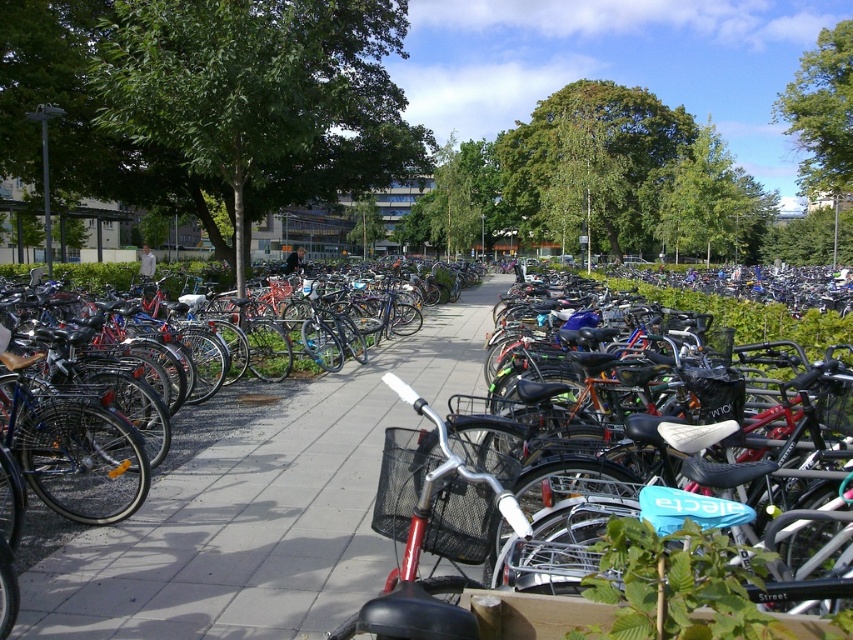
Question: Which point is closer to the camera?

Choices:
 (A) coord(473,444)
 (B) coord(131,616)

Answer: (B)

Question: Which of the following is the closest to the observer?

Choices:
 (A) matte black bicycle at center
 (B) gray concrete pavement at center

Answer: (A)

Question: In this image, where is gray concrete pavement at center located relative to matte black bicycle at center?

Choices:
 (A) below
 (B) above

Answer: (A)

Question: Is gray concrete pavement at center thinner than matte black bicycle at center?

Choices:
 (A) yes
 (B) no

Answer: (B)

Question: Where is gray concrete pavement at center located in relation to matte black bicycle at center in the image?

Choices:
 (A) left
 (B) right

Answer: (A)